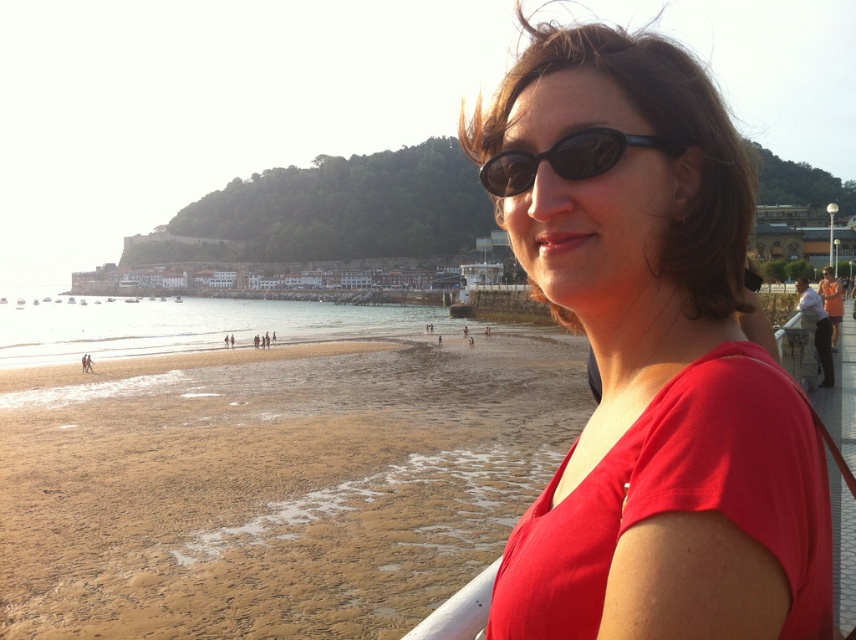
Question: In this image, where is sandy beach at lower left located relative to sunglasses at center?

Choices:
 (A) right
 (B) left

Answer: (B)

Question: Which point is closer to the camera taking this photo?

Choices:
 (A) (508, 192)
 (B) (661, 61)
 (C) (266, 600)

Answer: (B)

Question: Which object appears closest to the camera in this image?

Choices:
 (A) sandy beach at lower left
 (B) matte red shirt at center
 (C) sunglasses at center

Answer: (B)

Question: Which object is farther from the camera taking this photo?

Choices:
 (A) matte red shirt at center
 (B) sunglasses at center

Answer: (B)

Question: Is sandy beach at lower left smaller than matte red shirt at center?

Choices:
 (A) yes
 (B) no

Answer: (B)

Question: Is matte red shirt at center below sunglasses at center?

Choices:
 (A) no
 (B) yes

Answer: (B)